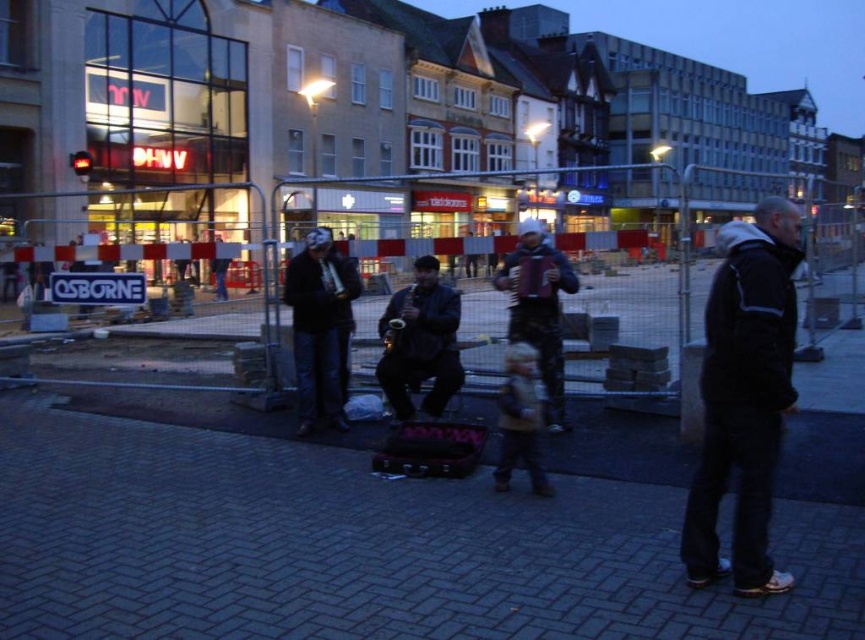
Question: Is matte black mask at center behind dark blue fabric jacket at center?

Choices:
 (A) no
 (B) yes

Answer: (B)

Question: Which object appears farthest from the camera in this image?

Choices:
 (A) matte black mask at center
 (B) dark brick pavement at lower center
 (C) dark blue leather jacket at center

Answer: (A)

Question: Which is nearer to the dark blue leather jacket at center?

Choices:
 (A) dark blue fabric jacket at center
 (B) black matte jacket at right

Answer: (A)

Question: Which point appears closest to the camera in this image?

Choices:
 (A) (559, 260)
 (B) (325, 378)
 (C) (540, 552)

Answer: (C)

Question: Does black matte jacket at right appear under matte black mask at center?

Choices:
 (A) no
 (B) yes

Answer: (B)

Question: Can you confirm if dark brick pavement at lower center is positioned to the left of black matte jacket at right?

Choices:
 (A) no
 (B) yes

Answer: (B)